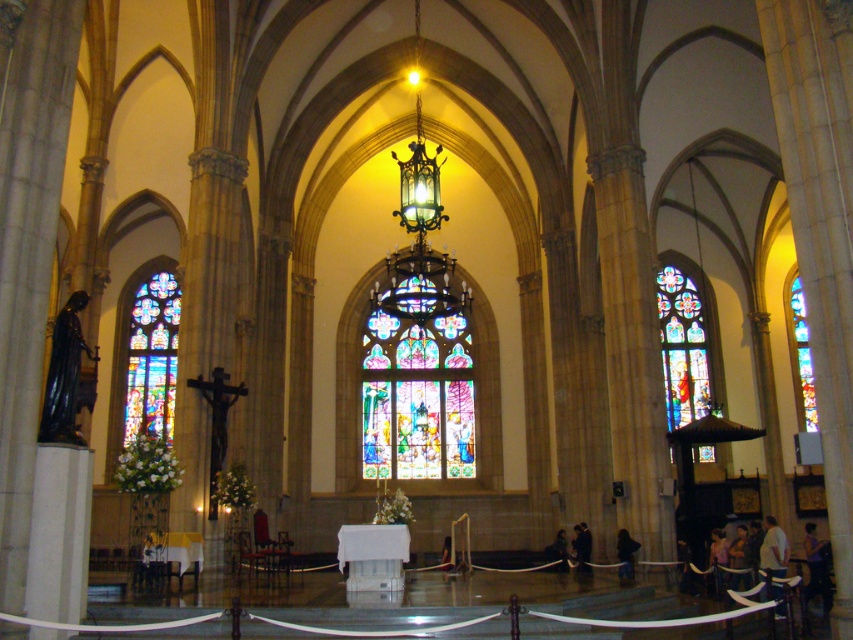
Question: Which point appears farthest from the camera in this image?

Choices:
 (A) (799, 304)
 (B) (134, 355)

Answer: (A)

Question: Among these points, which one is farthest from the camera?

Choices:
 (A) (798, 312)
 (B) (787, 545)

Answer: (A)

Question: Which of the following is the closest to the observer?

Choices:
 (A) (695, 371)
 (B) (167, 381)
 (C) (422, 394)

Answer: (B)

Question: Can you confirm if light brown leather jacket at lower right is smaller than dark skin textured person at lower right?

Choices:
 (A) no
 (B) yes

Answer: (A)

Question: Is multicolored stained glass at right smaller than light brown leather jacket at lower right?

Choices:
 (A) no
 (B) yes

Answer: (A)

Question: Is stained glass window at left further to camera compared to dark skin textured person at lower right?

Choices:
 (A) no
 (B) yes

Answer: (B)